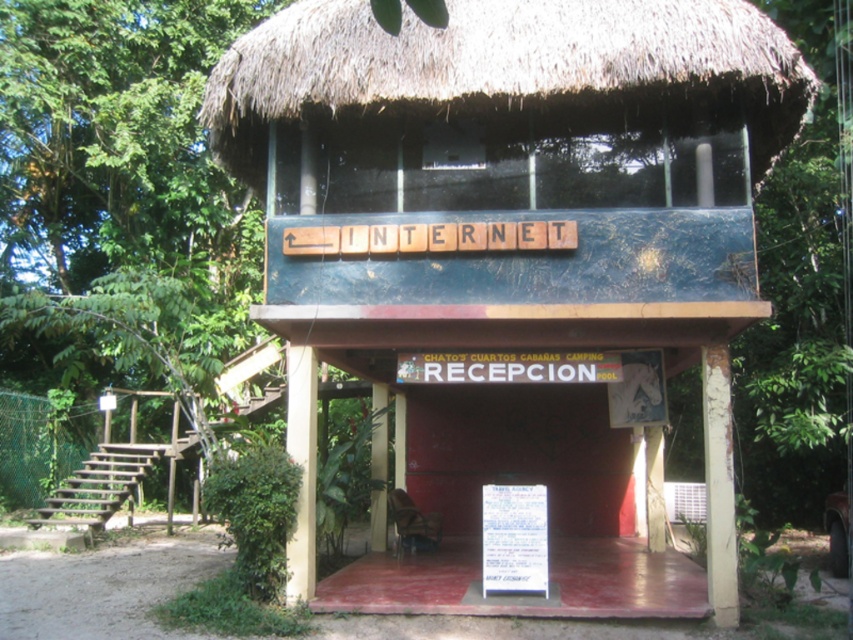
Question: From the image, what is the correct spatial relationship of blue painted wood hut at center in relation to white paper sign at center?

Choices:
 (A) right
 (B) left

Answer: (A)

Question: Which object is farther from the camera taking this photo?

Choices:
 (A) blue painted wood hut at center
 (B) white paper sign at center

Answer: (B)

Question: Does blue painted wood hut at center lie behind white paper sign at center?

Choices:
 (A) yes
 (B) no

Answer: (B)

Question: Which point is closer to the camera taking this photo?

Choices:
 (A) (367, 268)
 (B) (498, 547)

Answer: (B)

Question: Is blue painted wood hut at center wider than white paper sign at center?

Choices:
 (A) yes
 (B) no

Answer: (B)